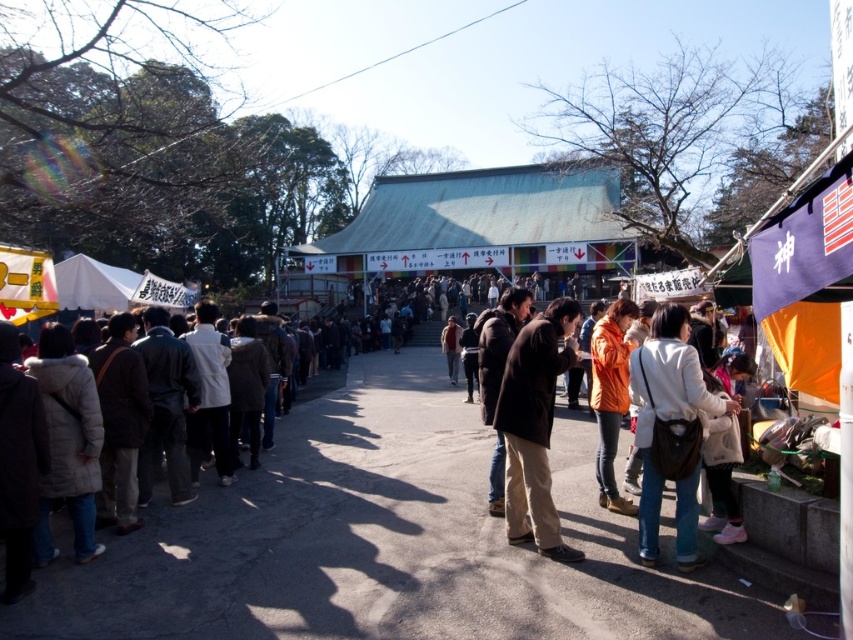
You are at a festival and see two people wearing jackets. One is wearing a light beige leather jacket at lower right and the other an orange matte jacket at center. Which jacket is positioned to the right of the other?

The light beige leather jacket at lower right is positioned on the right side of orange matte jacket at center.

You are standing at the point marked as point (663, 464) in the image. If you want to take a photo of the crowd in the foreground, will you need to adjust your camera focus to be closer or farther than 14.95 feet to capture the crowd clearly?

The distance of point (663, 464) from the camera is 14.95 feet. To capture the crowd in the foreground clearly, you need to adjust the camera focus to be closer than 14.95 feet because the crowd is closer to the camera than the point.